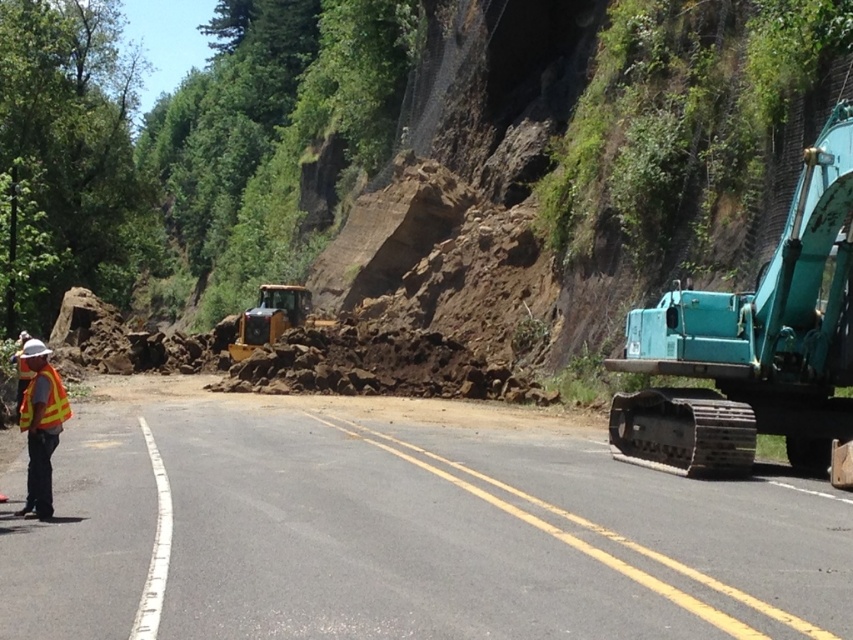
You are a delivery driver who needs to navigate a truck that is 20 feet long through the construction zone shown in the image. The truck must pass between the teal metallic excavator at right and the yellow reflective vest at left. Can the truck safely maneuver through this space without hitting either object?

The distance between the teal metallic excavator at right and the yellow reflective vest at left is 33.30 feet. Since the truck is 20 feet long, there is sufficient space for it to pass safely between them without any collisions.

You are a pedestrian trying to cross the road. You see the black asphalt road at lower left and the reflective yellow safety vest at left. Which object is closer to you?

The reflective yellow safety vest at left is closer to you because it is taller than the black asphalt road at lower left.